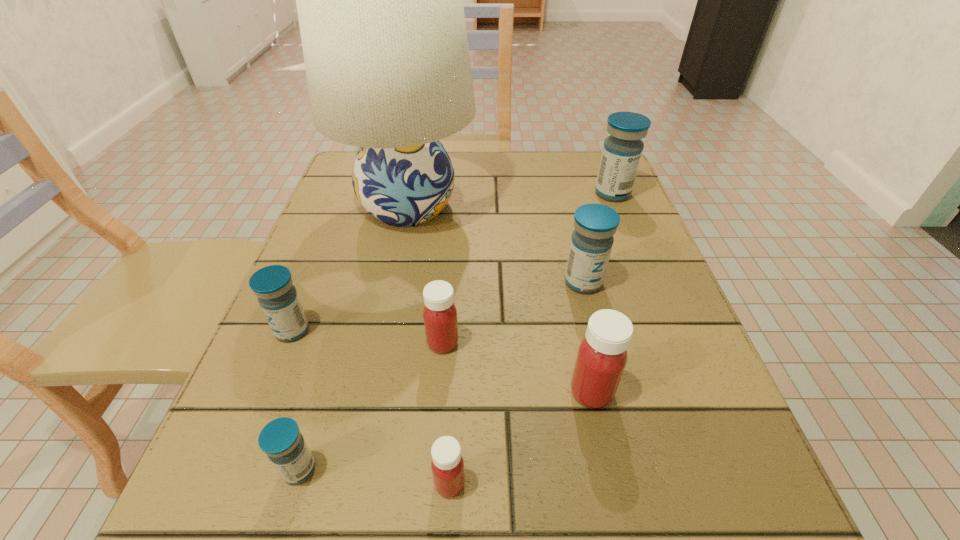
What are the coordinates of `lampshade` in the screenshot? It's located at (380, 6).

Locate an element on the screen. the tallest object is located at coordinates (380, 6).

Find the location of a particular element. the tallest medicine is located at coordinates (622, 150).

The width and height of the screenshot is (960, 540). In order to click on the rightmost object in this screenshot , I will do `click(622, 150)`.

Image resolution: width=960 pixels, height=540 pixels. Identify the location of the sixth nearest medicine. (592, 239).

Where is `the second blue medicine from right to left`? The image size is (960, 540). the second blue medicine from right to left is located at coordinates (592, 239).

At what (x,y) coordinates should I click in order to perform the action: click on the third nearest object. Please return your answer as a coordinate pair (x, y). Looking at the image, I should click on (602, 355).

Identify the location of the second nearest red medicine. This screenshot has height=540, width=960. (602, 355).

The height and width of the screenshot is (540, 960). Identify the location of the second smallest blue medicine. (277, 296).

Where is `the leftmost blue medicine`? the leftmost blue medicine is located at coordinates (277, 296).